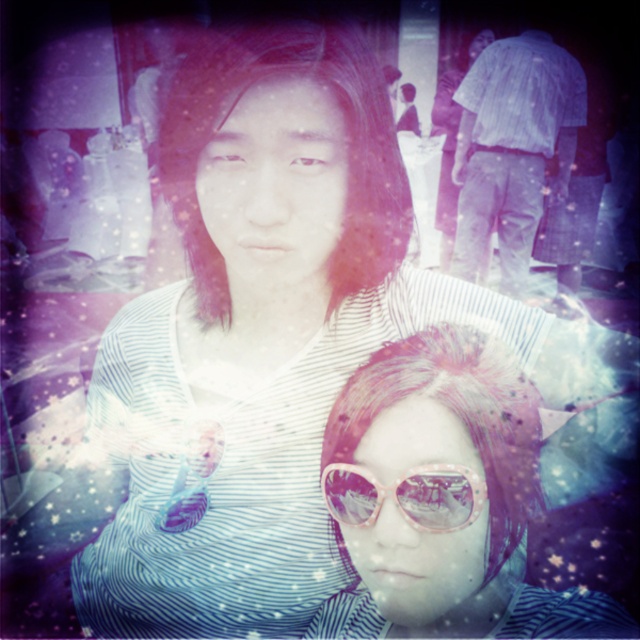
From the picture: You are designing a layout for a magazine cover and need to place a text box between the light blue striped shirt at upper right and the pink shiny sunglasses at center. If the text box must be narrower than both objects, can you fit it between them?

The light blue striped shirt at upper right might be wider than pink shiny sunglasses at center, so the text box must be narrower than the narrower of the two. However, since we don not know the exact width of the sunglasses, it is uncertain if the text box can fit between them.

You are a photographer trying to capture a closeup shot of the pink plastic sunglasses at center and the light blue striped shirt at upper right. Can you fit both subjects into your camera frame if your camera has a maximum field of view of 3 meters?

The pink plastic sunglasses at center and light blue striped shirt at upper right are 3.08 meters apart, which exceeds the camera frame of 3 meters. Therefore, you cannot fit both subjects into the frame.

In the scene shown: You are designing a display case for a fashion boutique. The case has a width of 1 meter. You need to place both the pink plastic sunglasses at center and the light blue striped shirt at upper right inside. Can both items fit side by side without overlapping?

The pink plastic sunglasses at center has a lesser width compared to light blue striped shirt at upper right. Since the total width of both items combined is less than 1 meter, they can fit side by side in the display case without overlapping.